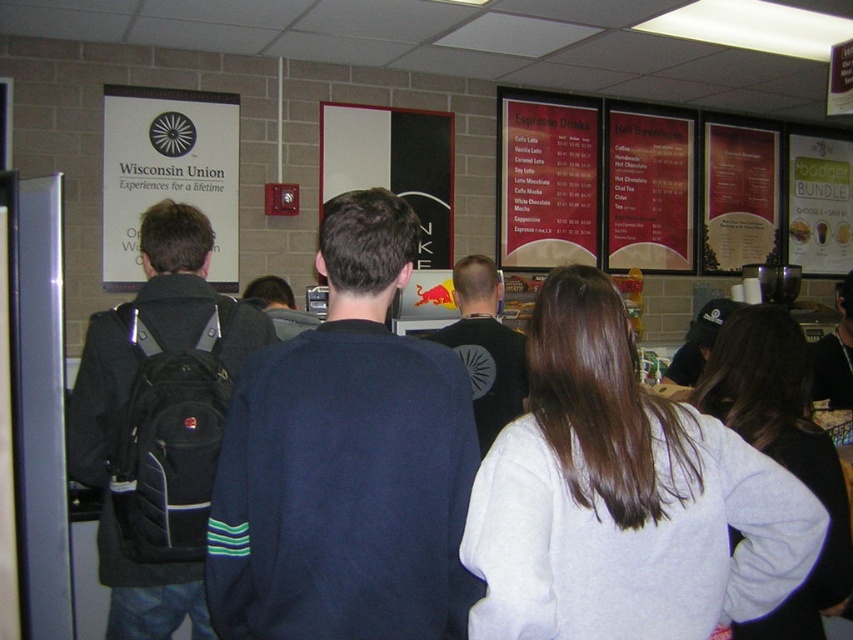
Which is below, dark blue sweater at center or gray fleece sweatshirt at center?

gray fleece sweatshirt at center is below.

Between dark blue sweater at center and gray fleece sweatshirt at center, which one appears on the left side from the viewer's perspective?

Positioned to the left is dark blue sweater at center.

Is point (367, 198) positioned in front of point (828, 445)?

That is True.

Image resolution: width=853 pixels, height=640 pixels. In order to click on dark blue sweater at center in this screenshot , I will do `click(346, 461)`.

Can you confirm if gray fleece sweatshirt at center is positioned above black fabric shirt at center?

Incorrect, gray fleece sweatshirt at center is not positioned above black fabric shirt at center.

Can you confirm if gray fleece sweatshirt at center is wider than black fabric shirt at center?

In fact, gray fleece sweatshirt at center might be narrower than black fabric shirt at center.

Between point (811, 458) and point (506, 349), which one is positioned in front?

Point (811, 458) is more forward.

The height and width of the screenshot is (640, 853). In order to click on gray fleece sweatshirt at center in this screenshot , I will do `click(781, 448)`.

Is white fleece sweatshirt at center above black fabric shirt at center?

Incorrect, white fleece sweatshirt at center is not positioned above black fabric shirt at center.

How far apart are white fleece sweatshirt at center and black fabric shirt at center?

A distance of 4.06 feet exists between white fleece sweatshirt at center and black fabric shirt at center.

Who is more distant from viewer, (604, 374) or (498, 410)?

Point (498, 410)

In order to click on white fleece sweatshirt at center in this screenshot , I will do (624, 497).